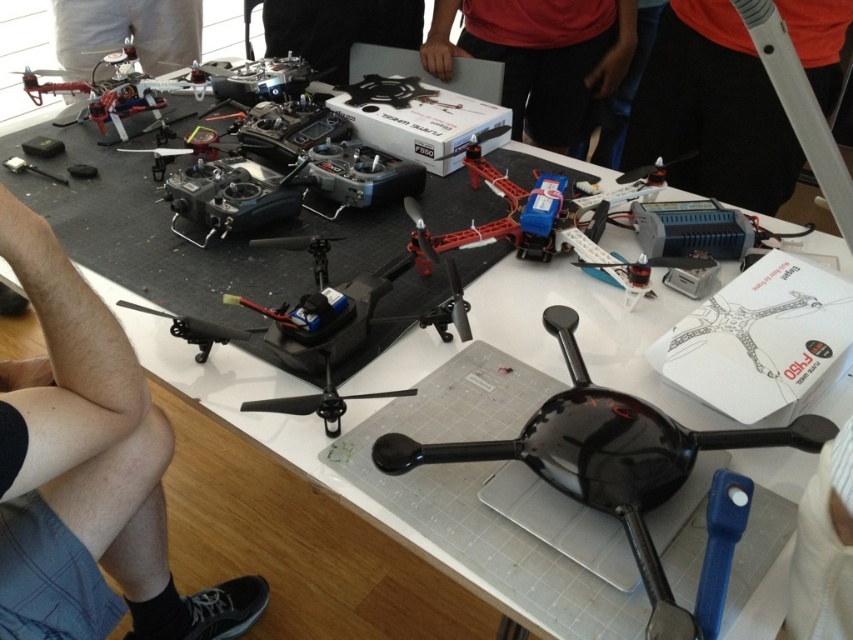
You are a technician working in a drone workshop. You notice two drones on the table. The black glossy drone at center and the black plastic drone at lower left. Which drone is closer to the edge of the table?

The black plastic drone at lower left is closer to the edge of the table because it is positioned above the black glossy drone at center, which is underneath it.

You are an engineer working on assembling a drone. You need to access the black glossy drone at center for adjustments. However, there is a metallic silver screwdriver at lower left in the way. Can you reach the drone without moving the screwdriver?

The black glossy drone at center is positioned under the metallic silver screwdriver at lower left, meaning the screwdriver is above it. Since the screwdriver is not blocking the path directly, you can reach the drone without moving the screwdriver.

You are holding a tool that requires a minimum of 24 inches of space to operate safely. You need to use this tool on the black glossy drone at center. Based on your current position relative to the drone, is there enough space to safely use the tool?

The black glossy drone at center and viewer are 26.36 inches apart. Since the required minimum space is 24 inches, there is enough space to safely use the tool because 26.36 inches exceeds the 24 inch requirement.